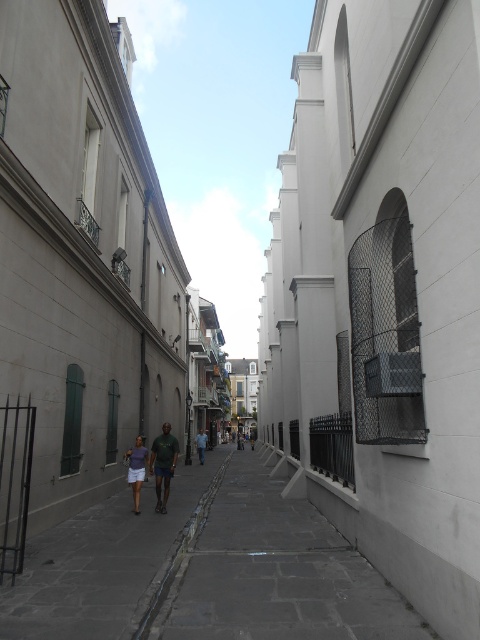
Does point (73, 580) lie behind point (130, 483)?

No, it is not.

In the scene shown: Who is more distant from viewer, (35, 586) or (127, 456)?

Point (127, 456)

Locate an element on the screen. This screenshot has width=480, height=640. dark gray concrete pavement at center is located at coordinates (108, 563).

Locate an element on the screen. dark gray concrete pavement at center is located at coordinates (108, 563).

Does dark gray concrete pavement at center come behind matte purple shorts at center?

No, dark gray concrete pavement at center is in front of matte purple shorts at center.

Does dark gray concrete pavement at center have a smaller size compared to matte purple shorts at center?

No.

The width and height of the screenshot is (480, 640). Find the location of `dark gray concrete pavement at center`. dark gray concrete pavement at center is located at coordinates (108, 563).

Find the location of a particular element. Image resolution: width=480 pixels, height=640 pixels. dark gray concrete pavement at center is located at coordinates (108, 563).

Is matte purple shorts at center bigger than matte purple shirt at center?

Yes.

Looking at this image, between matte purple shorts at center and matte purple shirt at center, which one appears on the left side from the viewer's perspective?

From the viewer's perspective, matte purple shirt at center appears more on the left side.

The width and height of the screenshot is (480, 640). I want to click on matte purple shorts at center, so click(154, 465).

Find the location of `matte purple shorts at center`. matte purple shorts at center is located at coordinates (154, 465).